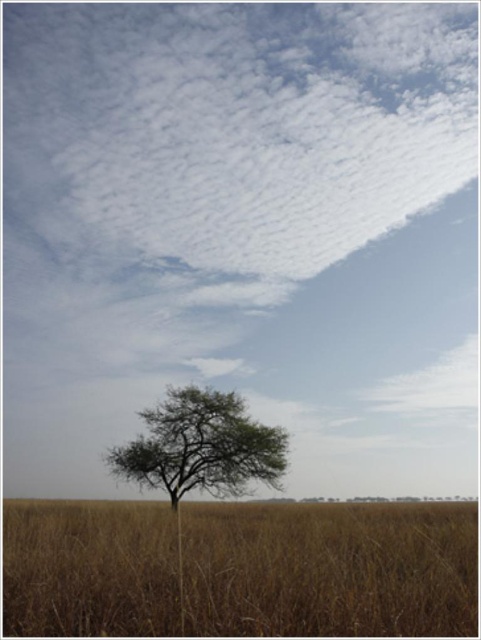
Between brown dry grass at lower center and green leafy tree at center, which one has more height?

Standing taller between the two is brown dry grass at lower center.

This screenshot has height=640, width=481. Identify the location of brown dry grass at lower center. (329, 570).